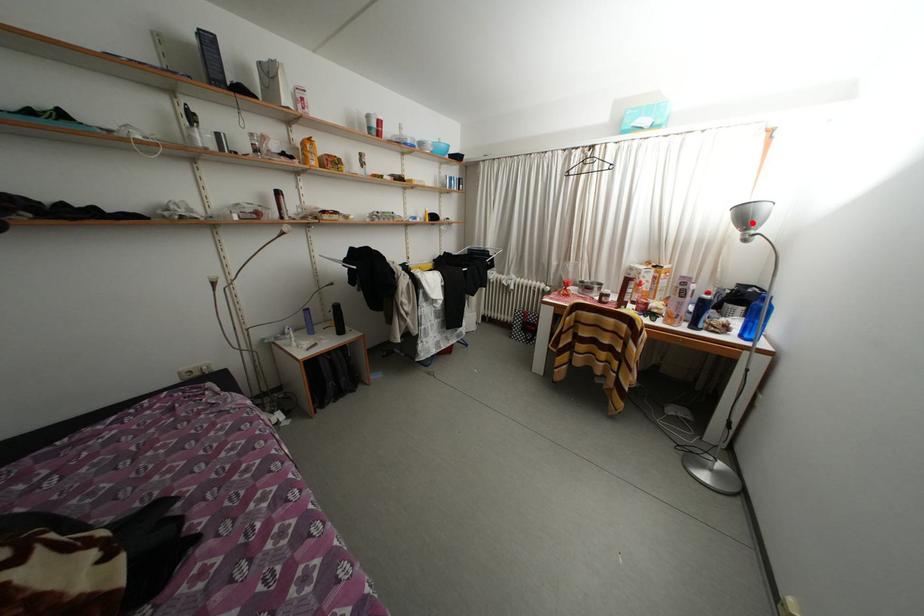
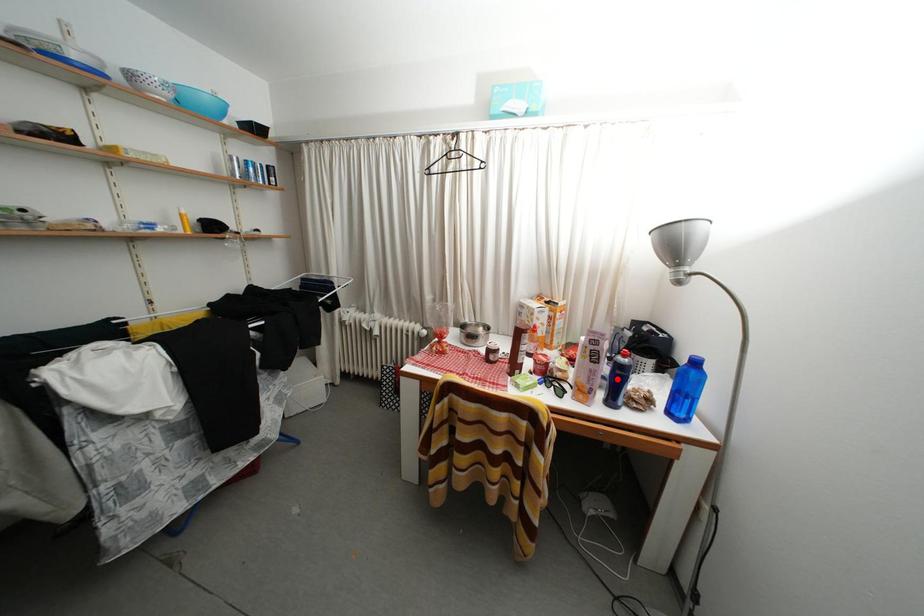
I am providing you with two images of the same scene from different viewpoints. A red point is marked on the first image and another point is marked on the second image. Does the point marked in image1 correspond to the same location as the one in image2?

No